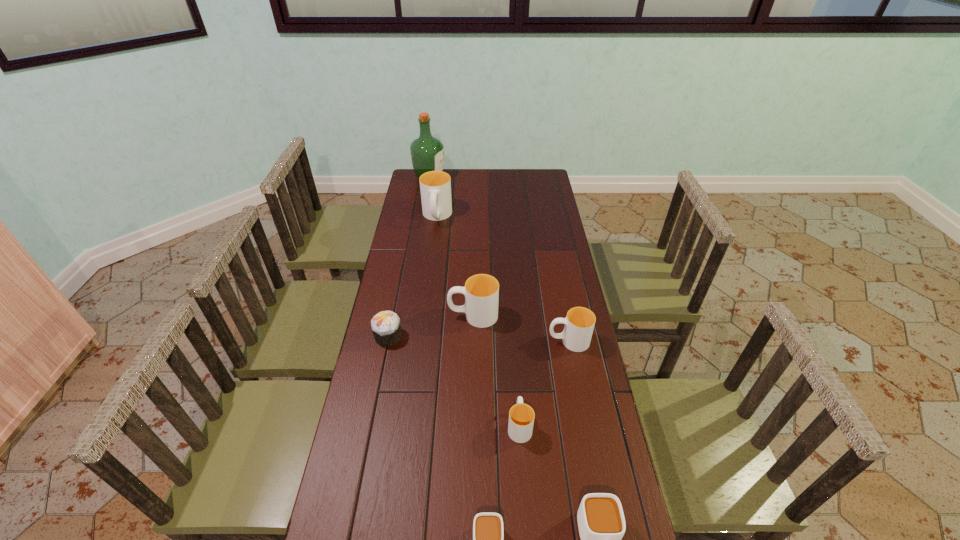
Where is `vacant space situated 0.340m with the handle on the side of the fourth farthest cup`? This screenshot has width=960, height=540. vacant space situated 0.340m with the handle on the side of the fourth farthest cup is located at coordinates (513, 324).

At what (x,y) coordinates should I click in order to perform the action: click on blank area located 0.140m with the handle on the side of the fourth farthest cup. Please return your answer as a coordinate pair (x, y). The width and height of the screenshot is (960, 540). Looking at the image, I should click on (516, 370).

The image size is (960, 540). In order to click on free space located with the handle on the side of the fourth farthest cup in this screenshot , I will do `click(516, 386)`.

Locate an element on the screen. This screenshot has height=540, width=960. object located in the far edge section of the desktop is located at coordinates (427, 152).

Where is `liquor that is at the left edge`? This screenshot has height=540, width=960. liquor that is at the left edge is located at coordinates (427, 152).

You are a GUI agent. You are given a task and a screenshot of the screen. Output one action in this format:
    pyautogui.click(x=<x>, y=<y>)
    Task: Click on the cup present at the left edge
    This screenshot has height=540, width=960.
    Given the screenshot: What is the action you would take?
    pyautogui.click(x=435, y=186)

Find the location of a particular element. This screenshot has height=540, width=960. cupcake that is at the left edge is located at coordinates [x=386, y=327].

This screenshot has width=960, height=540. Find the location of `object positioned at the right edge`. object positioned at the right edge is located at coordinates (579, 323).

At what (x,y) coordinates should I click in order to perform the action: click on object that is at the far left corner. Please return your answer as a coordinate pair (x, y). The height and width of the screenshot is (540, 960). Looking at the image, I should click on (427, 152).

This screenshot has height=540, width=960. In the image, there is a desktop. Identify the location of vacant space at the far edge. (495, 178).